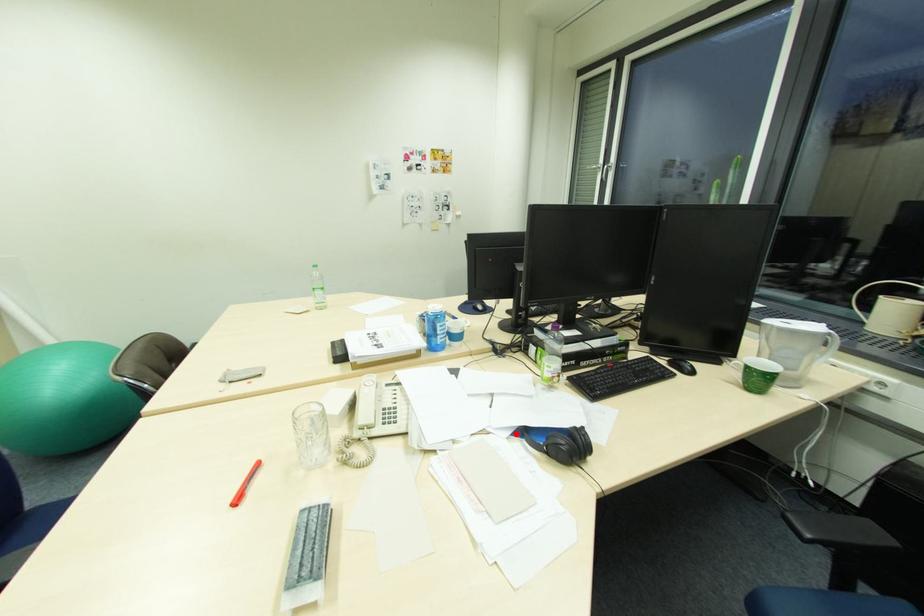
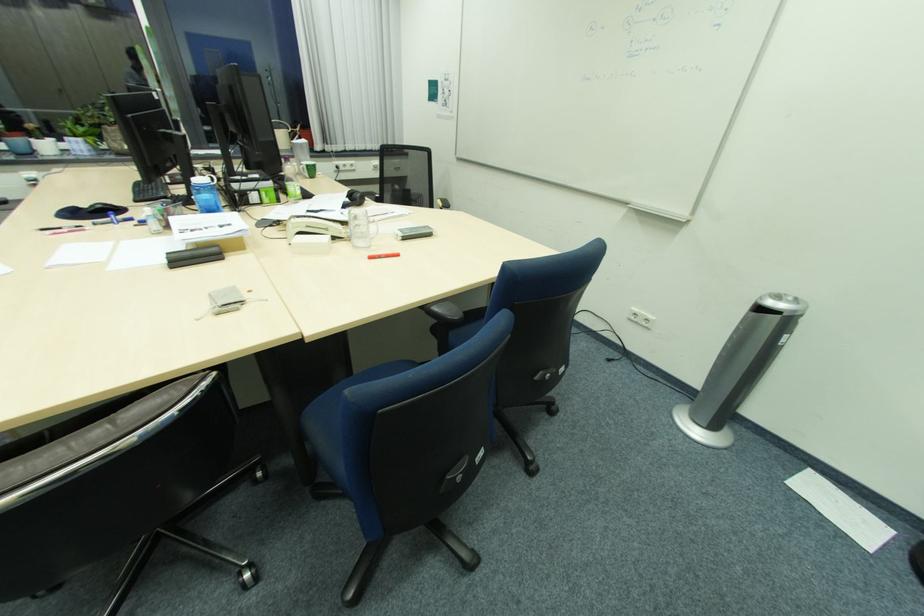
Question: I am providing you with two images of the same scene from different viewpoints. A red point is marked on the first image. Is the red point's position out of view in image 2?

Choices:
 (A) Yes
 (B) No

Answer: (B)